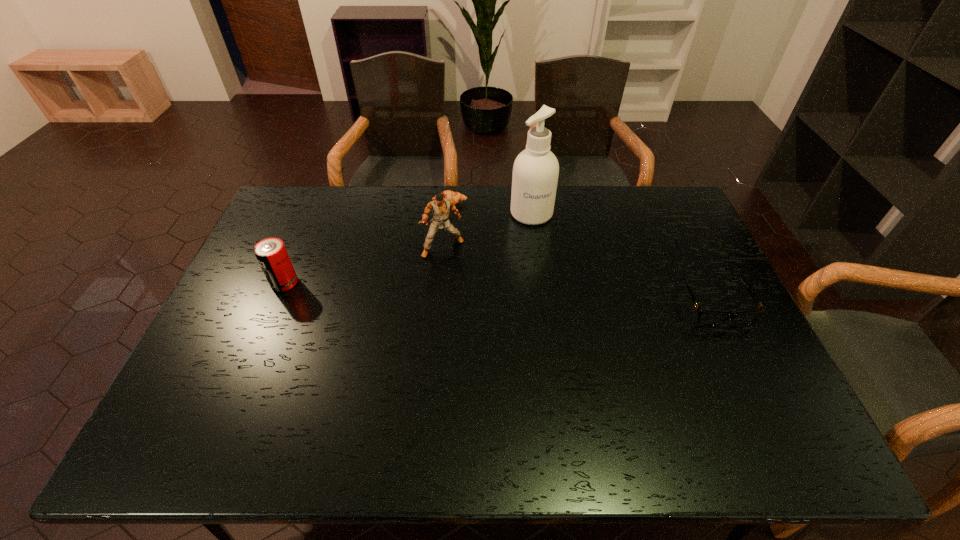
At what (x,y) coordinates should I click in order to perform the action: click on vacant space on the desktop that is between the third shortest object and the fourth tallest object and is positioned on the front-facing side of the shortest object. Please return your answer as a coordinate pair (x, y). Looking at the image, I should click on (456, 292).

Locate an element on the screen. The width and height of the screenshot is (960, 540). free spot on the desktop that is between the can and the second shortest object and is positioned on the front-facing side of the fourth shortest object is located at coordinates (464, 292).

In order to click on free spot on the desktop that is between the can and the second shortest object and is positioned on the front label of the cleansing agent in this screenshot , I will do `click(557, 297)`.